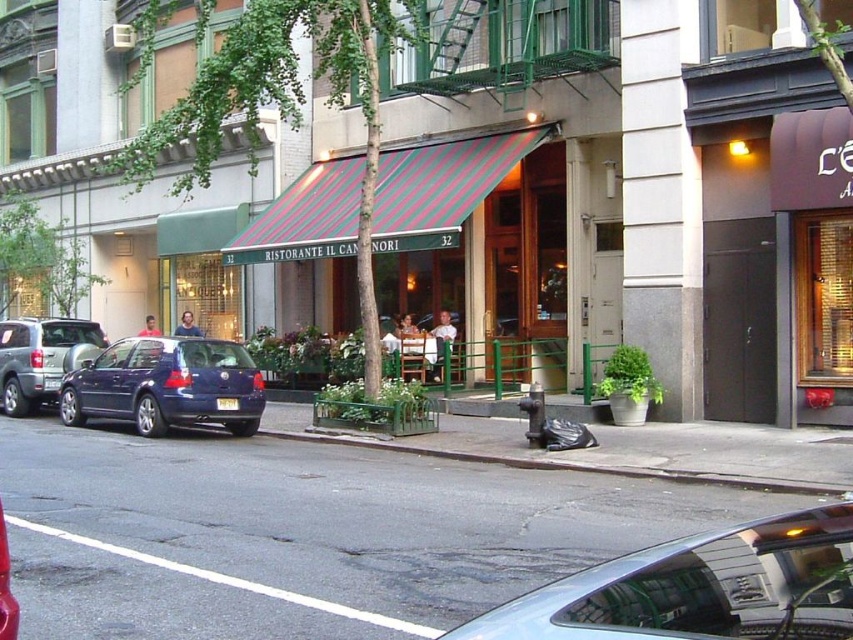
Question: Estimate the real-world distances between objects in this image. Which object is farther from the metallic blue hatchback at left?

Choices:
 (A) gray concrete curb at lower center
 (B) metallic silver suv at left
 (C) silver metallic car at center

Answer: (C)

Question: Is metallic blue hatchback at left thinner than gray concrete curb at lower center?

Choices:
 (A) yes
 (B) no

Answer: (A)

Question: Is metallic blue hatchback at left in front of gray concrete curb at lower center?

Choices:
 (A) yes
 (B) no

Answer: (B)

Question: Which of the following is the farthest from the observer?

Choices:
 (A) metallic silver suv at left
 (B) gray concrete curb at lower center
 (C) metallic blue hatchback at left

Answer: (A)

Question: Which of the following is the farthest from the observer?

Choices:
 (A) (142, 429)
 (B) (53, 342)
 (C) (828, 627)
 (D) (672, 472)

Answer: (B)

Question: Is silver metallic car at center below metallic silver suv at left?

Choices:
 (A) no
 (B) yes

Answer: (B)